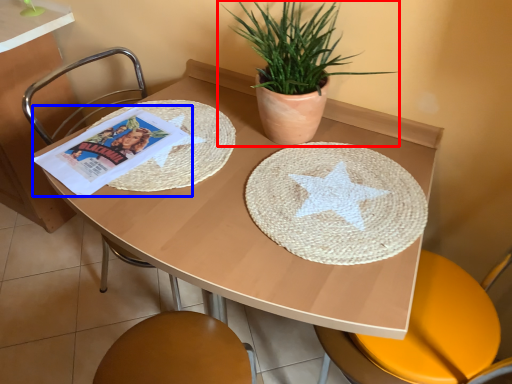
Question: Among these objects, which one is nearest to the camera, houseplant (highlighted by a red box) or comic book (highlighted by a blue box)?

Choices:
 (A) houseplant
 (B) comic book

Answer: (A)